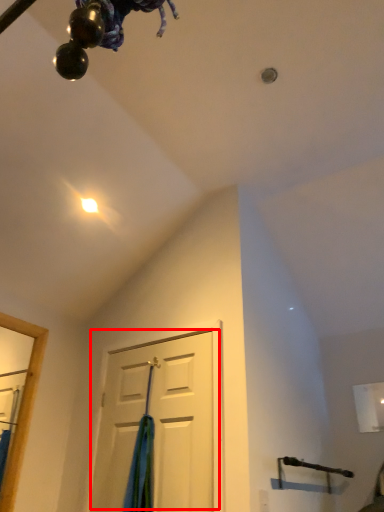
Question: From the image, what is the correct spatial relationship of door (annotated by the red box) in relation to curtain?

Choices:
 (A) right
 (B) left

Answer: (A)